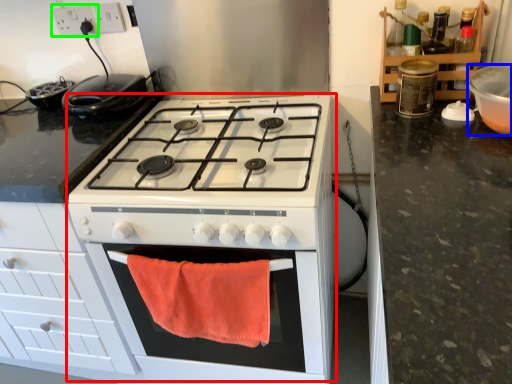
Question: Based on their relative distances, which object is farther from appliance (highlighted by a red box)? Choose from appliance (highlighted by a blue box) and electric outlet (highlighted by a green box).

Choices:
 (A) appliance
 (B) electric outlet

Answer: (B)